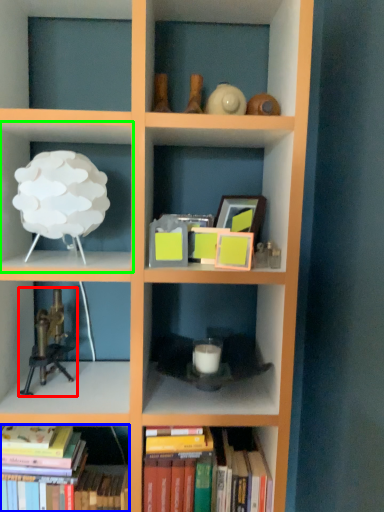
Question: Based on their relative distances, which object is farther from toy (highlighted by a red box)? Choose from book (highlighted by a blue box) and shelf (highlighted by a green box).

Choices:
 (A) book
 (B) shelf

Answer: (B)